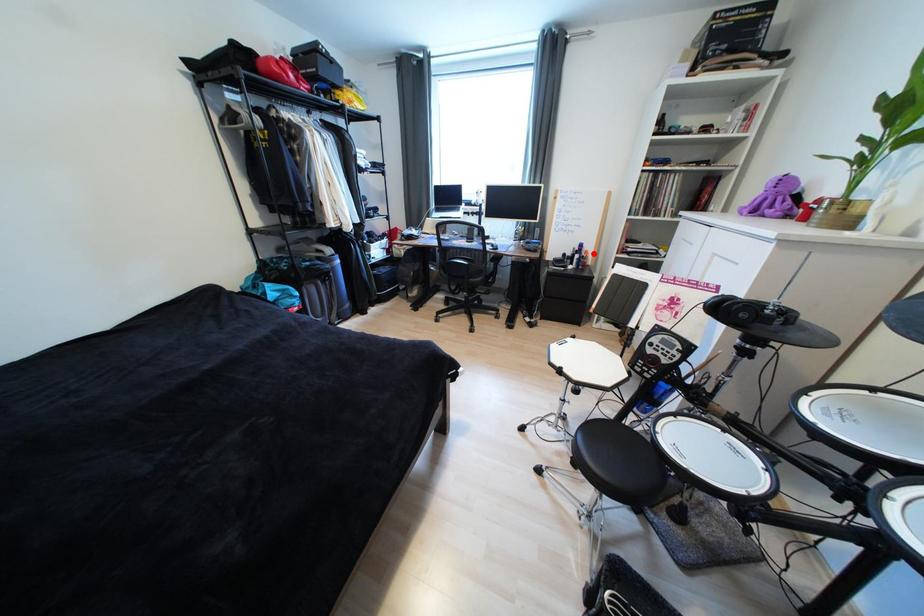
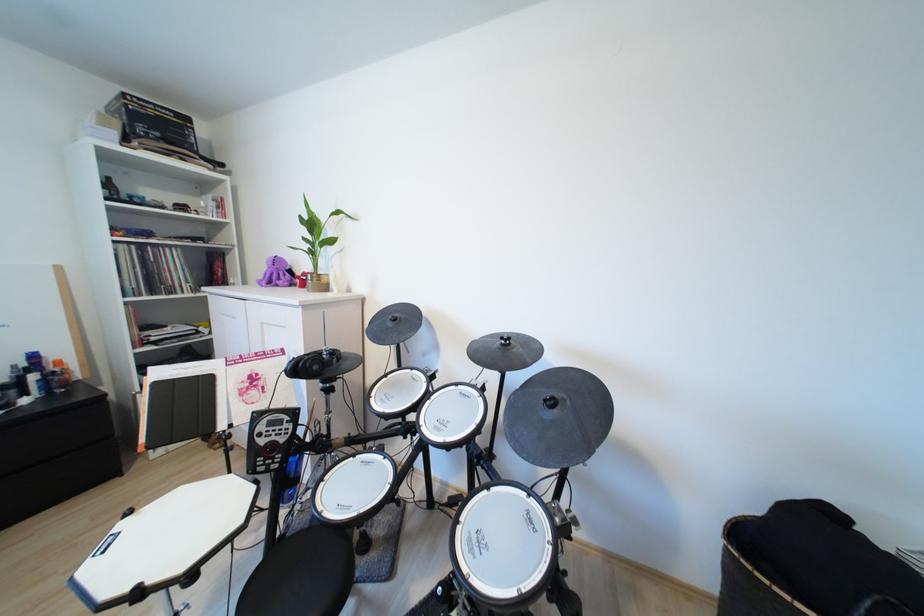
Question: A red point is marked in image1. In image2, is the corresponding 3D point closer to the camera or farther? Reply with the corresponding letter.

Choices:
 (A) The corresponding 3D point is closer.
 (B) The corresponding 3D point is farther.

Answer: (B)